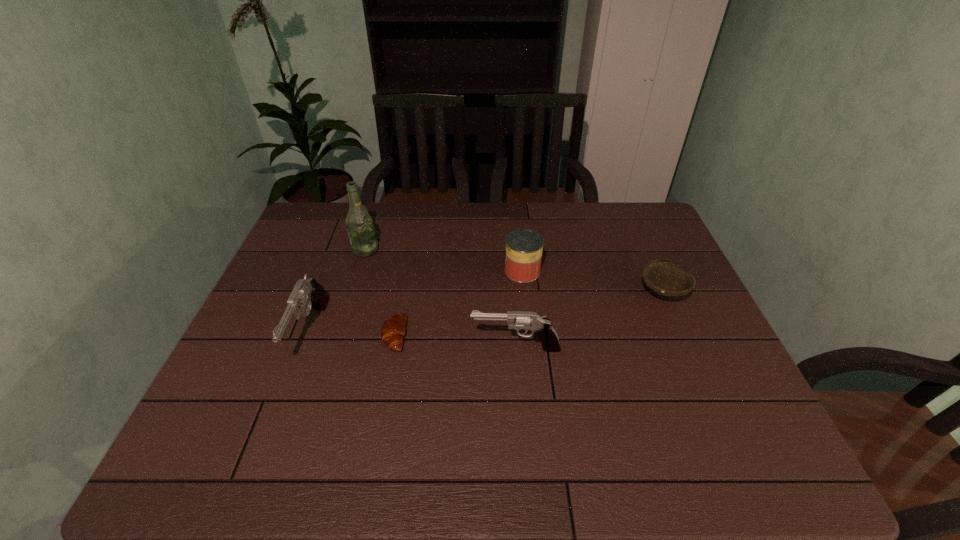
Locate an element on the screen. This screenshot has height=540, width=960. the second tallest object is located at coordinates (308, 291).

Where is `the leftmost object`? This screenshot has width=960, height=540. the leftmost object is located at coordinates (308, 291).

The width and height of the screenshot is (960, 540). In order to click on the shorter gun in this screenshot , I will do `click(541, 328)`.

Where is `the tallest object`? The width and height of the screenshot is (960, 540). the tallest object is located at coordinates (359, 224).

Locate an element on the screen. This screenshot has height=540, width=960. the farthest object is located at coordinates (359, 224).

I want to click on bowl, so click(662, 278).

This screenshot has height=540, width=960. In order to click on the rightmost object in this screenshot , I will do `click(662, 278)`.

Where is `can`? The height and width of the screenshot is (540, 960). can is located at coordinates (523, 256).

This screenshot has width=960, height=540. What are the coordinates of `the shortest object` in the screenshot? It's located at (393, 330).

The width and height of the screenshot is (960, 540). I want to click on the third object from left to right, so click(393, 330).